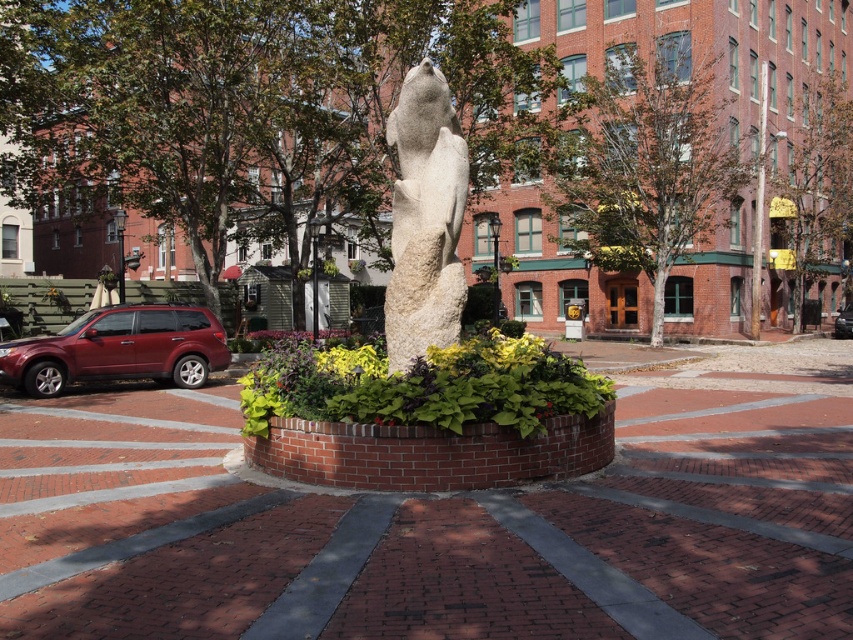
You are standing in the plaza and want to take a photo of the white stone statue at center. If your camera can focus on objects up to 7 meters away, will you need to move closer or farther away to capture the statue clearly?

The white stone statue at center is 7.32 meters from viewer, which is beyond the camera focus range of 7 meters. You need to move closer to ensure the statue is within the camera focus range.

You are standing in the plaza and want to take a photo of the sculpture. You notice two points marked on the ground at coordinates point (419, 333) and point (842, 321). Which point is closer to you when facing the sculpture?

Point (419, 333) is closer to the viewer than point (842, 321).

You are a delivery person needing to park your vehicle in the parking lot. The parking spot is designed to accommodate vehicles up to the size of the metallic silver sedan at center. Can the matte red suv at left fit into this parking spot?

The matte red suv at left has a smaller size compared to the metallic silver sedan at center. Since the parking spot is designed for vehicles up to the size of the metallic silver sedan at center, the matte red suv at left can fit into the parking spot.